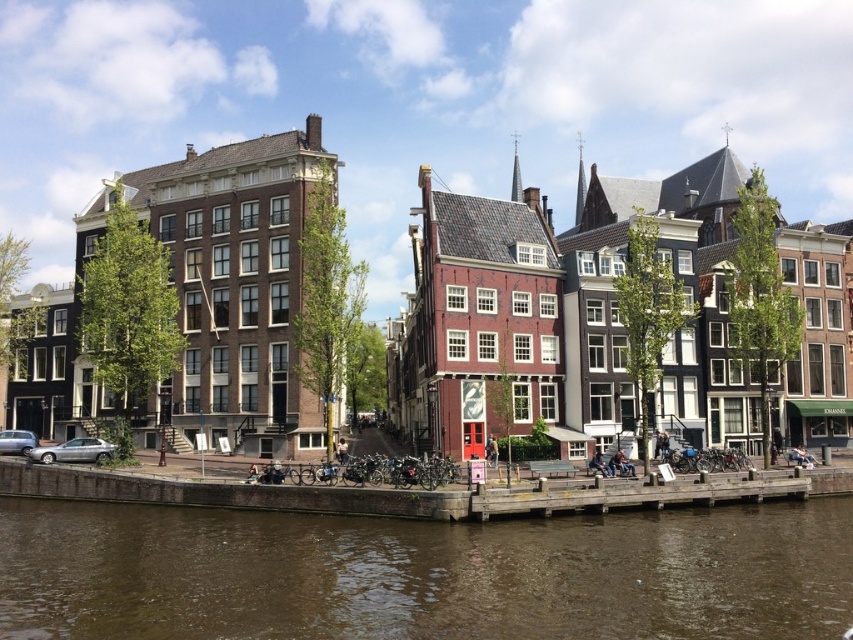
Question: Does brown murky water at lower center appear over wooden dock at lower center?

Choices:
 (A) yes
 (B) no

Answer: (B)

Question: Is brown murky water at lower center bigger than wooden dock at lower center?

Choices:
 (A) yes
 (B) no

Answer: (A)

Question: Among these objects, which one is nearest to the camera?

Choices:
 (A) wooden dock at lower center
 (B) brown murky water at lower center

Answer: (B)

Question: Can you confirm if brown murky water at lower center is positioned above wooden dock at lower center?

Choices:
 (A) no
 (B) yes

Answer: (A)